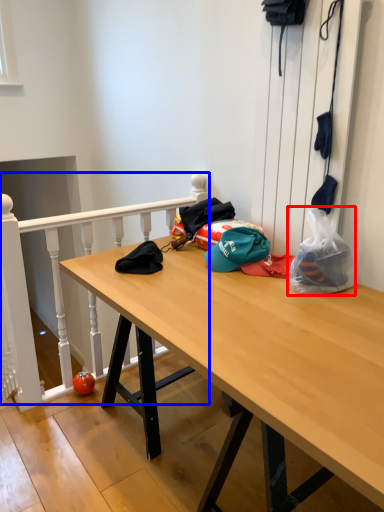
Question: Which of the following is the closest to the observer, plastic bag (highlighted by a red box) or rail (highlighted by a blue box)?

Choices:
 (A) plastic bag
 (B) rail

Answer: (A)